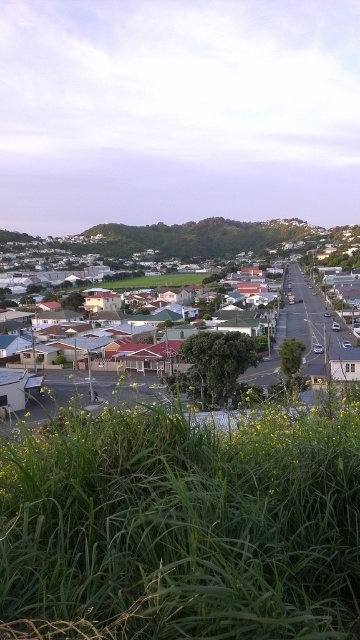
Question: Can you confirm if green grass at lower left is wider than red tiled roofs at center?

Choices:
 (A) yes
 (B) no

Answer: (B)

Question: Is matte white houses at center wider than red tiled roofs at center?

Choices:
 (A) no
 (B) yes

Answer: (B)

Question: Which object is farther from the camera taking this photo?

Choices:
 (A) green grass at lower left
 (B) green grassy hillside at center
 (C) red tiled roofs at center

Answer: (B)

Question: Among these objects, which one is nearest to the camera?

Choices:
 (A) red tiled roofs at center
 (B) green grass at lower left
 (C) matte white houses at center
 (D) green grassy hillside at center

Answer: (B)

Question: Which point is farther to the camera?

Choices:
 (A) green grassy hillside at center
 (B) red tiled roofs at center
 (C) green grass at lower left
 (D) matte white houses at center

Answer: (A)

Question: Is matte white houses at center further to camera compared to red tiled roofs at center?

Choices:
 (A) no
 (B) yes

Answer: (B)